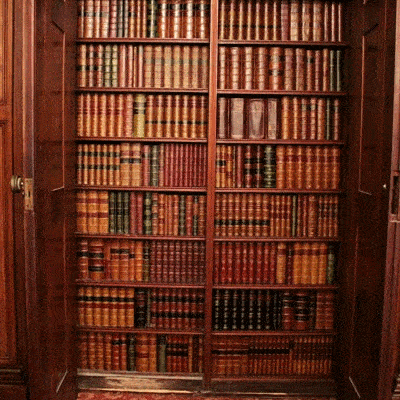
Where is `doorknob`? doorknob is located at coordinates pyautogui.click(x=15, y=184).